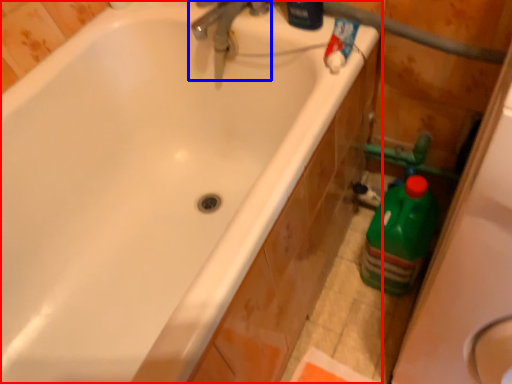
Question: Which object is further to the camera taking this photo, bathtub (highlighted by a red box) or tap (highlighted by a blue box)?

Choices:
 (A) bathtub
 (B) tap

Answer: (B)